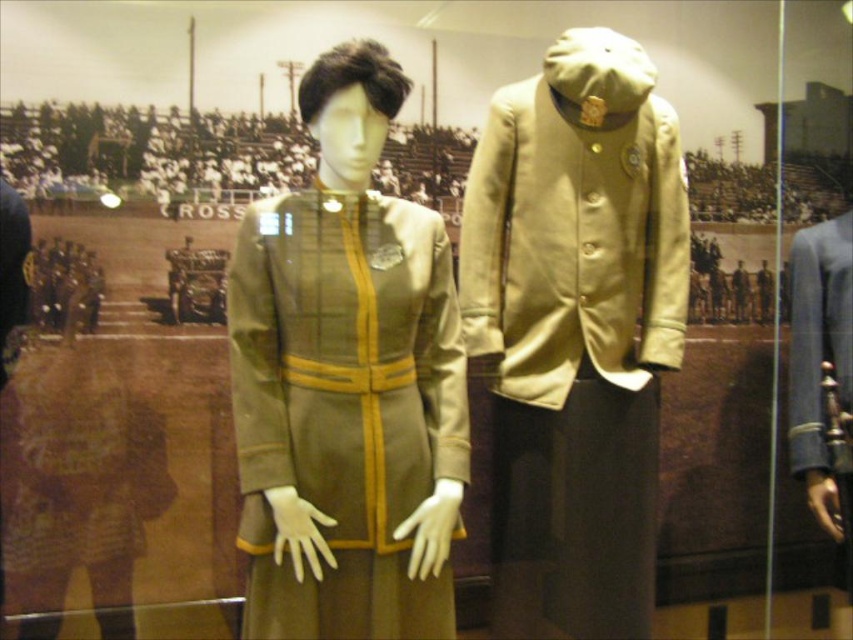
You are a fashion designer observing the display case with two mannequins. You notice a specific point at coordinates [347,381]. Which object in the scene is located at this point?

The point at coordinates [347,381] is located at the matte green fabric dress at center.

You are standing in front of a display case with two mannequins. The mannequin on the left is wearing a long olive green coat with gold trim, and the mannequin on the right has a similar uniform but with a cap. There is also a matte green fabric dress at center. Based on their positions, which object is closer to the center of the display case?

The matte green fabric dress at center is exactly at the center of the display case, so it is the closest to the center.